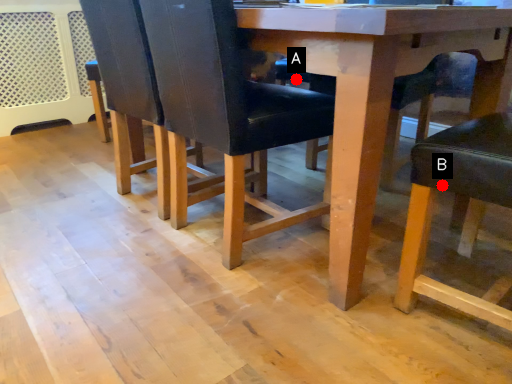
Question: Two points are circled on the image, labeled by A and B beside each circle. Among these points, which one is farthest from the camera?

Choices:
 (A) A is further
 (B) B is further

Answer: (A)